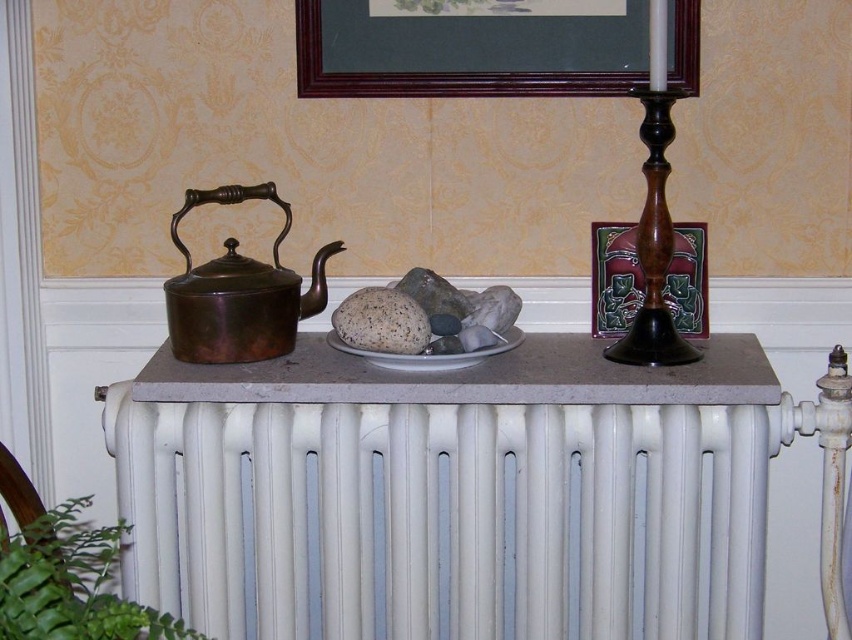
You are organizing a small display on a surface and have two items to place side by side. You have a white painted radiator at center and a white ceramic plate at center. Based on their widths, which item should you place first to ensure they fit properly?

The white painted radiator at center might be wider than white ceramic plate at center, so you should place the radiator first to accommodate its larger width.

You are arranging flowers in the living room and need to place a vase between the wooden picture frame at upper center and the matte wooden candlestick at right. Can you fit the vase between them horizontally?

The wooden picture frame at upper center is above the matte wooden candlestick at right, so they are not aligned horizontally. Therefore, you cannot place a vase between them horizontally as they are positioned vertically relative to each other.